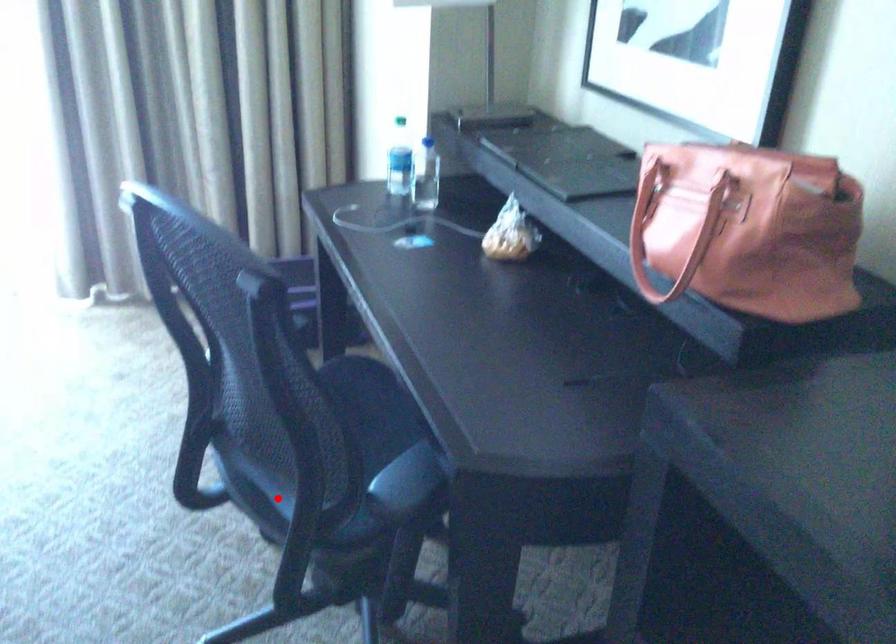
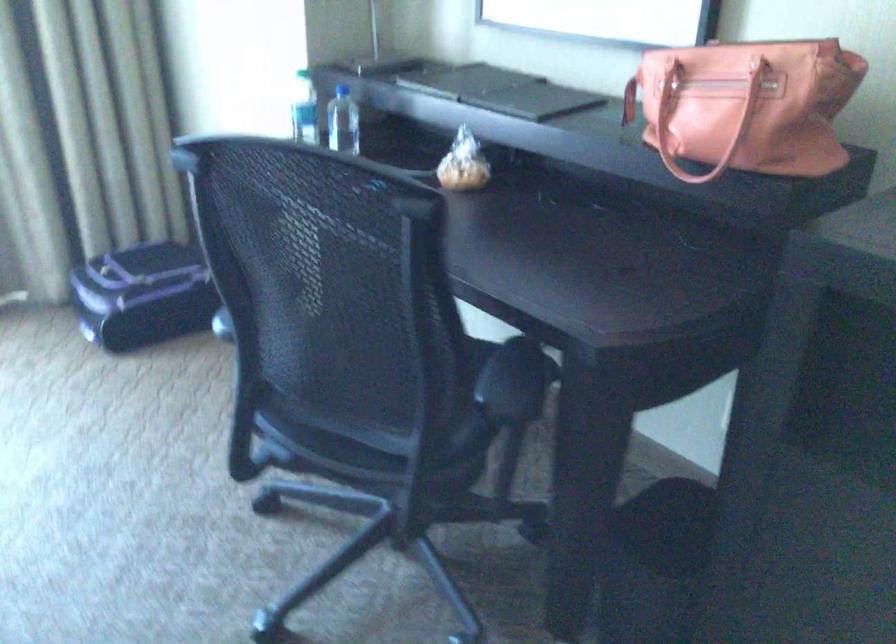
In the second image, find the point that corresponds to the highlighted location in the first image.

(364, 440)